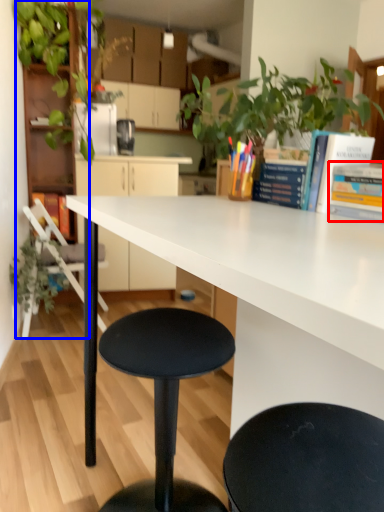
Question: Which object is closer to the camera taking this photo, book (highlighted by a red box) or bookshelf (highlighted by a blue box)?

Choices:
 (A) book
 (B) bookshelf

Answer: (A)